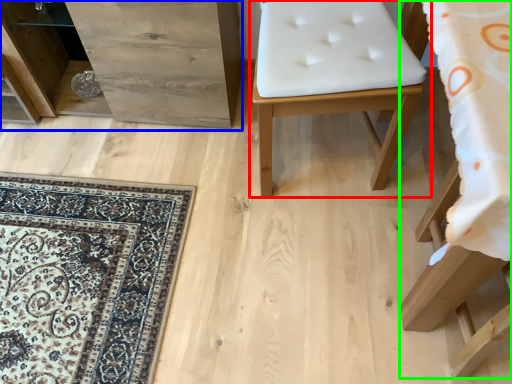
Question: Estimate the real-world distances between objects in this image. Which object is closer to furniture (highlighted by a red box), dresser (highlighted by a blue box) or furniture (highlighted by a green box)?

Choices:
 (A) dresser
 (B) furniture

Answer: (B)